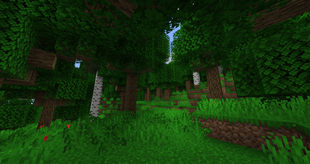
Identify the location of column=. Image resolution: width=310 pixels, height=164 pixels. (96, 89).